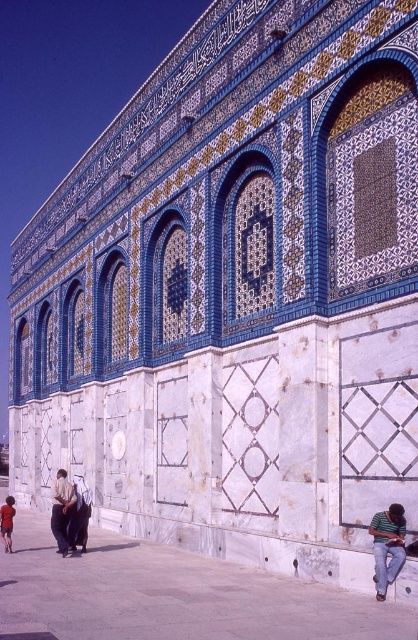
You are standing in front of the Dome of the Rock and notice a dark brown leather jacket at lower left and a red fabric child at lower left. Which object is narrower?

The dark brown leather jacket at lower left is narrower than the red fabric child at lower left.